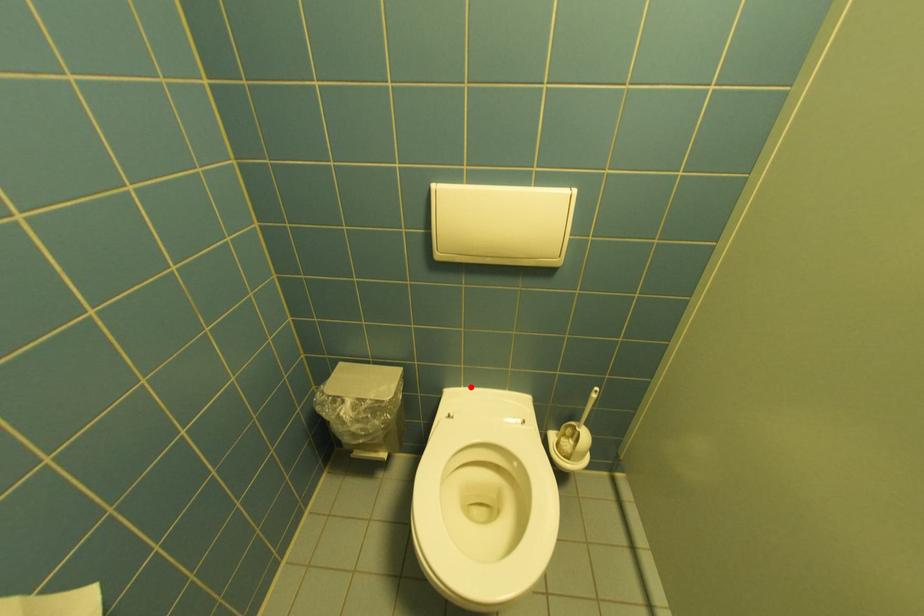
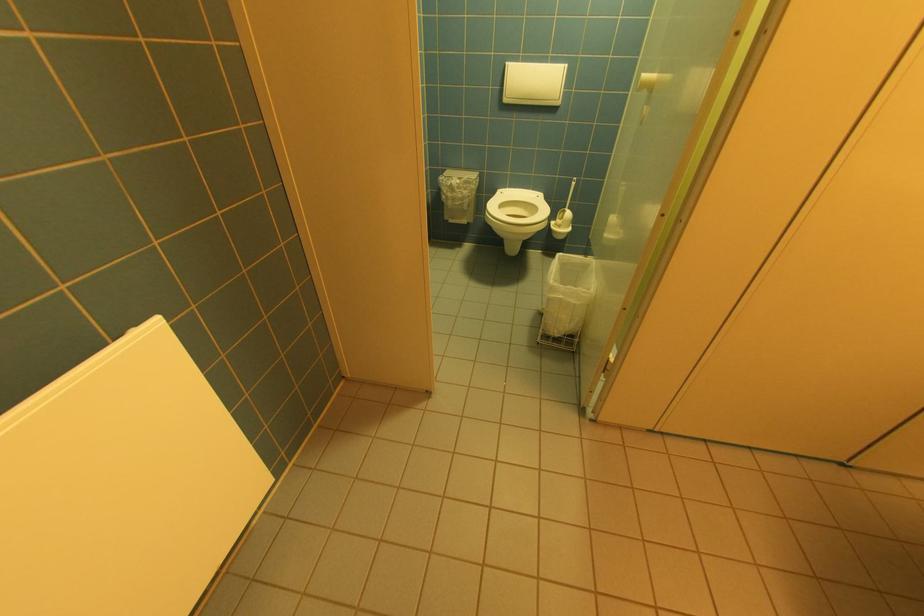
Question: I am providing you with two images of the same scene from different viewpoints. Image1 has a red point marked. In image2, the corresponding 3D location appears at what relative position? Reply with the corresponding letter.

Choices:
 (A) Closer
 (B) Farther

Answer: (A)